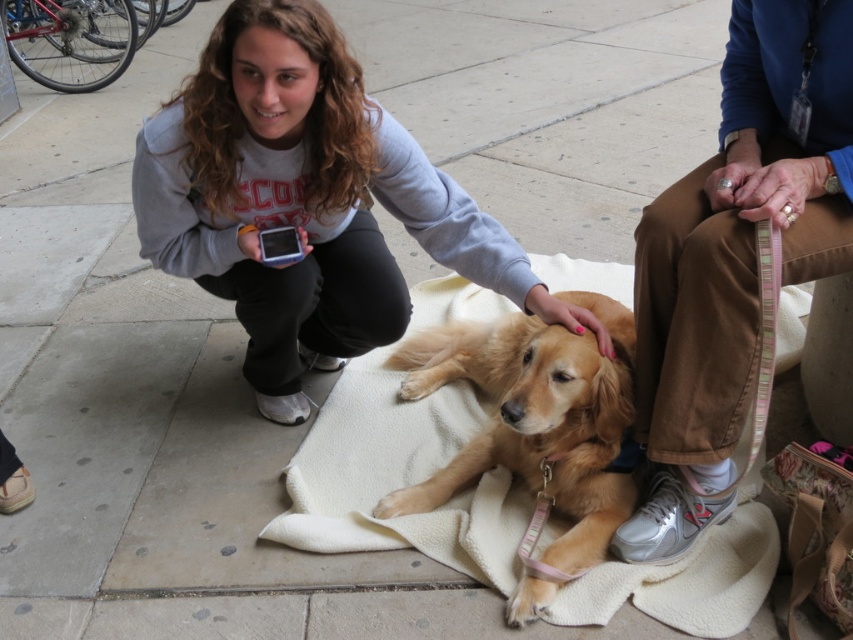
Is matte gray sweatshirt at center positioned at the back of white fleece blanket at center?

Yes, it is behind white fleece blanket at center.

Where is `matte gray sweatshirt at center`? matte gray sweatshirt at center is located at coordinates (306, 202).

Is matte gray sweatshirt at center to the right of pink striped leash at lower right from the viewer's perspective?

In fact, matte gray sweatshirt at center is to the left of pink striped leash at lower right.

Describe the element at coordinates (306, 202) in the screenshot. I see `matte gray sweatshirt at center` at that location.

Measure the distance between point (x=173, y=224) and camera.

Point (x=173, y=224) and camera are 5.73 feet apart from each other.

This screenshot has width=853, height=640. In order to click on matte gray sweatshirt at center in this screenshot , I will do `click(306, 202)`.

Is point (782, 141) positioned behind point (550, 468)?

That is False.

Is pink striped leash at lower right shorter than golden fur dog at center?

No.

What are the coordinates of `pink striped leash at lower right` in the screenshot? It's located at click(735, 253).

Find the location of a particular element. The height and width of the screenshot is (640, 853). pink striped leash at lower right is located at coordinates (735, 253).